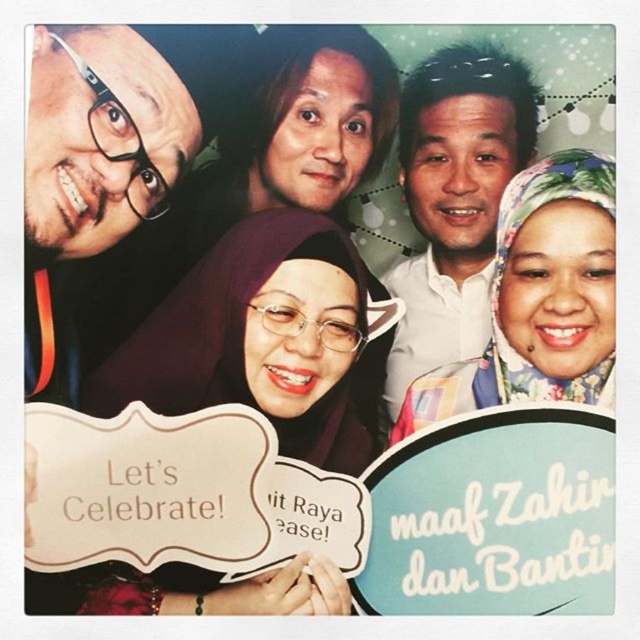
Question: Is matte brown hijab at center bigger than matte black glasses at left?

Choices:
 (A) yes
 (B) no

Answer: (A)

Question: Which object is farther from the camera taking this photo?

Choices:
 (A) white shirt at center
 (B) matte brown hijab at center
 (C) floral fabric hijab at upper right

Answer: (A)

Question: Does matte brown hijab at center have a greater width compared to white shirt at center?

Choices:
 (A) no
 (B) yes

Answer: (B)

Question: Is matte brown hijab at center above floral fabric hijab at upper right?

Choices:
 (A) no
 (B) yes

Answer: (A)

Question: Which point is farther to the camera?

Choices:
 (A) matte black glasses at left
 (B) matte brown hijab at center
 (C) white shirt at center

Answer: (C)

Question: Which point appears farthest from the camera in this image?

Choices:
 (A) (x=141, y=83)
 (B) (x=260, y=374)
 (C) (x=550, y=291)

Answer: (B)